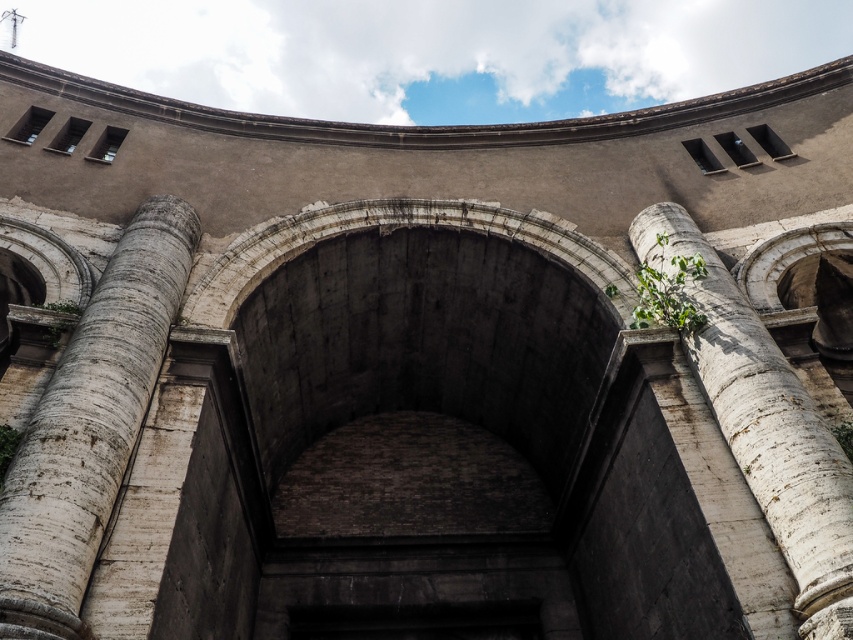
Is the position of white marble column at center more distant than that of white marble column at right?

No, it is in front of white marble column at right.

Between white marble column at center and white marble column at right, which one has more height?

white marble column at right is taller.

Who is more forward, (83,372) or (831,564)?

Positioned in front is point (831,564).

At what (x,y) coordinates should I click in order to perform the action: click on white marble column at center. Please return your answer as a coordinate pair (x, y). The height and width of the screenshot is (640, 853). Looking at the image, I should click on (90, 424).